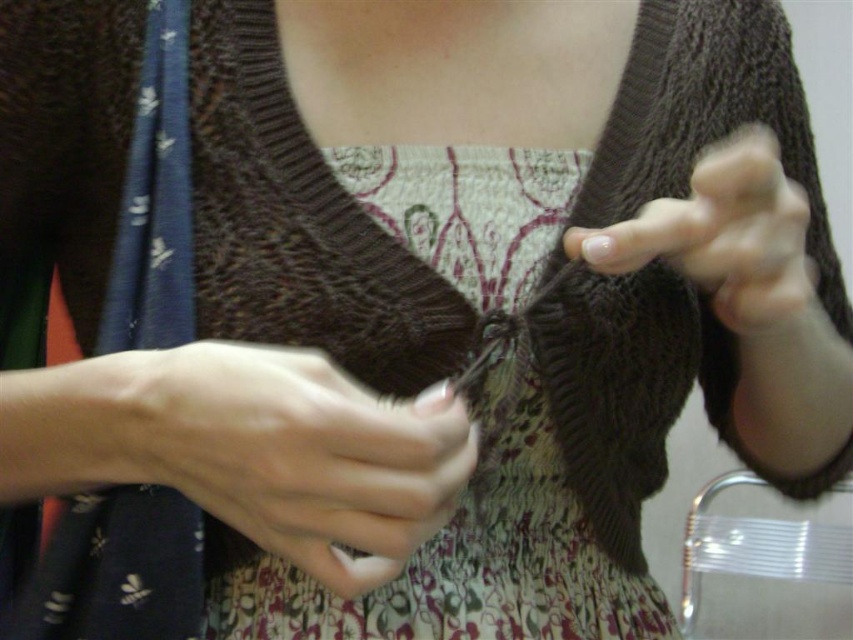
Is point (170, 374) positioned in front of point (804, 294)?

Yes, point (170, 374) is in front of point (804, 294).

Can you confirm if white matte skin at center is smaller than nail polish at center?

Yes.

What do you see at coordinates (300, 456) in the screenshot? I see `white matte skin at center` at bounding box center [300, 456].

Locate an element on the screen. The width and height of the screenshot is (853, 640). white matte skin at center is located at coordinates (300, 456).